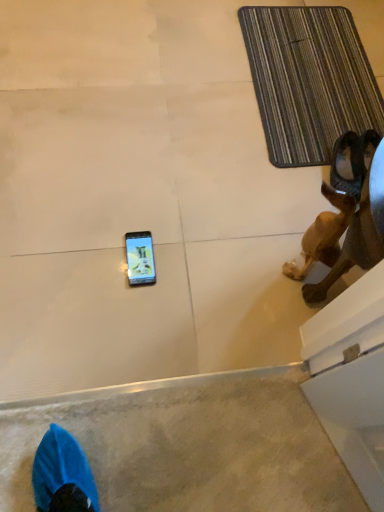
The width and height of the screenshot is (384, 512). Describe the element at coordinates (359, 219) in the screenshot. I see `brown leather dog at lower right` at that location.

The height and width of the screenshot is (512, 384). I want to click on brown leather dog at lower right, so click(x=359, y=219).

What do you see at coordinates (309, 80) in the screenshot?
I see `striped fabric bath mat at upper right` at bounding box center [309, 80].

The width and height of the screenshot is (384, 512). I want to click on striped fabric bath mat at upper right, so click(x=309, y=80).

At what (x,y) coordinates should I click in order to perform the action: click on brown leather dog at lower right. Please return your answer as a coordinate pair (x, y). The width and height of the screenshot is (384, 512). Looking at the image, I should click on (359, 219).

Between brown leather dog at lower right and striped fabric bath mat at upper right, which one appears on the right side from the viewer's perspective?

From the viewer's perspective, brown leather dog at lower right appears more on the right side.

Relative to striped fabric bath mat at upper right, is brown leather dog at lower right in front or behind?

brown leather dog at lower right is positioned closer to the viewer than striped fabric bath mat at upper right.

Which is in front, point (308, 303) or point (318, 144)?

Point (308, 303)

From the image's perspective, who appears lower, brown leather dog at lower right or striped fabric bath mat at upper right?

brown leather dog at lower right is shown below in the image.

From a real-world perspective, is brown leather dog at lower right located higher than striped fabric bath mat at upper right?

Yes, from a real-world perspective, brown leather dog at lower right is on top of striped fabric bath mat at upper right.

Is brown leather dog at lower right wider than striped fabric bath mat at upper right?

In fact, brown leather dog at lower right might be narrower than striped fabric bath mat at upper right.

Considering the sizes of objects brown leather dog at lower right and striped fabric bath mat at upper right in the image provided, who is taller, brown leather dog at lower right or striped fabric bath mat at upper right?

With more height is brown leather dog at lower right.

Is brown leather dog at lower right bigger or smaller than striped fabric bath mat at upper right?

brown leather dog at lower right is bigger than striped fabric bath mat at upper right.

From the picture: Is brown leather dog at lower right completely or partially outside of striped fabric bath mat at upper right?

brown leather dog at lower right is positioned outside striped fabric bath mat at upper right.

Does brown leather dog at lower right touch striped fabric bath mat at upper right?

No, brown leather dog at lower right is not next to striped fabric bath mat at upper right.

Is brown leather dog at lower right facing towards striped fabric bath mat at upper right?

Yes, brown leather dog at lower right faces towards striped fabric bath mat at upper right.

Can you tell me how much brown leather dog at lower right and striped fabric bath mat at upper right differ in facing direction?

The angle between the facing direction of brown leather dog at lower right and the facing direction of striped fabric bath mat at upper right is 91.6 degrees.

How distant is brown leather dog at lower right from striped fabric bath mat at upper right?

brown leather dog at lower right is 12.84 inches from striped fabric bath mat at upper right.

The height and width of the screenshot is (512, 384). Find the location of `bath mat located underneath the brown leather dog at lower right (from a real-world perspective)`. bath mat located underneath the brown leather dog at lower right (from a real-world perspective) is located at coordinates point(309,80).

Is striped fabric bath mat at upper right to the right of brown leather dog at lower right from the viewer's perspective?

No.

Does striped fabric bath mat at upper right lie in front of brown leather dog at lower right?

No, striped fabric bath mat at upper right is behind brown leather dog at lower right.

Is point (322, 150) farther from camera compared to point (368, 222)?

Yes, point (322, 150) is farther from viewer.

From the image's perspective, is striped fabric bath mat at upper right located beneath brown leather dog at lower right?

Incorrect, from the image's perspective, striped fabric bath mat at upper right is higher than brown leather dog at lower right.

In the scene shown: From a real-world perspective, between striped fabric bath mat at upper right and brown leather dog at lower right, who is vertically lower?

striped fabric bath mat at upper right is physically lower.

Does striped fabric bath mat at upper right have a lesser width compared to brown leather dog at lower right?

In fact, striped fabric bath mat at upper right might be wider than brown leather dog at lower right.

Considering the sizes of striped fabric bath mat at upper right and brown leather dog at lower right in the image, is striped fabric bath mat at upper right taller or shorter than brown leather dog at lower right?

Clearly, striped fabric bath mat at upper right is shorter compared to brown leather dog at lower right.

Between striped fabric bath mat at upper right and brown leather dog at lower right, which one has smaller size?

striped fabric bath mat at upper right is smaller.

Can we say striped fabric bath mat at upper right lies outside brown leather dog at lower right?

striped fabric bath mat at upper right is positioned outside brown leather dog at lower right.

Is striped fabric bath mat at upper right positioned far away from brown leather dog at lower right?

No.

Is striped fabric bath mat at upper right oriented away from brown leather dog at lower right?

No, striped fabric bath mat at upper right is not facing the opposite direction of brown leather dog at lower right.

How far apart are striped fabric bath mat at upper right and brown leather dog at lower right?

striped fabric bath mat at upper right is 12.84 inches from brown leather dog at lower right.

Identify the location of animal on the right of striped fabric bath mat at upper right. (359, 219).

Locate an element on the screen. This screenshot has height=512, width=384. bath mat on the left of brown leather dog at lower right is located at coordinates pyautogui.click(x=309, y=80).

Find the location of a particular element. This screenshot has height=512, width=384. bath mat behind the brown leather dog at lower right is located at coordinates (309, 80).